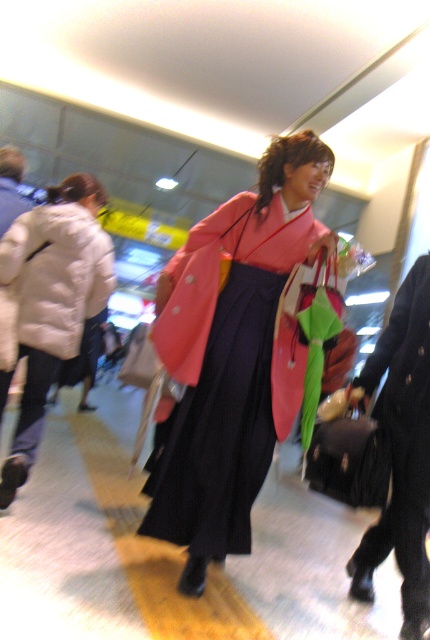
You are a photographer trying to capture a photo of the pink satin kimono at center and the white matte jacket at left. Since you want to highlight their sizes, which one should you zoom in on more to make them appear equally sized in the photo?

The pink satin kimono at center has a larger width than the white matte jacket at left, so you should zoom in more on the white matte jacket at left to make them appear equally sized in the photo.

You are a fashion designer observing the scene and want to recommend a coat to a client who prefers larger sizes. Which item would you suggest based on the sizes of the velvet black robe at lower right and the white puffy coat at left?

The velvet black robe at lower right has a larger size compared to the white puffy coat at left, so I would recommend the velvet black robe at lower right for the client who prefers larger sizes.

Based on the photo, you are a store employee who needs to hang the velvet black robe at lower right and the white puffy coat at left on adjacent hangers. The hangers are spaced 1 meter apart. Can both items fit side by side without overlapping?

The velvet black robe at lower right is narrower than the white puffy coat at left. Since the hangers are spaced 1 meter apart, and the robe is narrower, both items can fit side by side without overlapping.